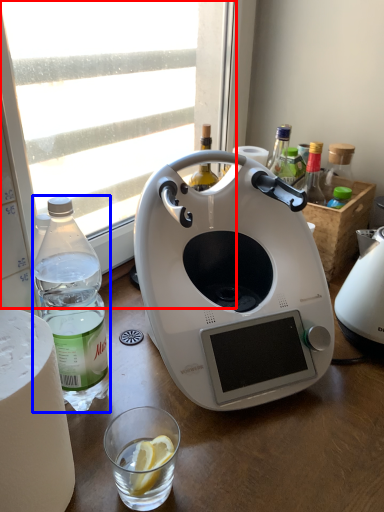
Question: Which of the following is the farthest to the observer, window (highlighted by a red box) or bottle (highlighted by a blue box)?

Choices:
 (A) window
 (B) bottle

Answer: (A)